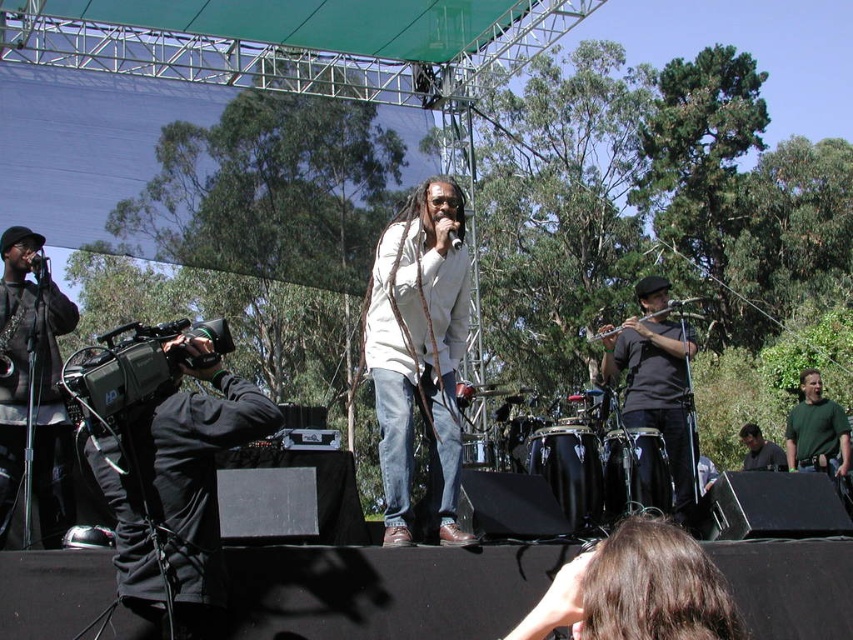
Question: Is green matte shirt at right positioned in front of green matte shirt at center?

Choices:
 (A) no
 (B) yes

Answer: (B)

Question: In this image, where is white matte jacket at center located relative to green matte shirt at center?

Choices:
 (A) left
 (B) right

Answer: (A)

Question: Is black matte shirt at right to the right of green matte shirt at center from the viewer's perspective?

Choices:
 (A) no
 (B) yes

Answer: (A)

Question: Among these points, which one is nearest to the camera?

Choices:
 (A) (451, 444)
 (B) (207, 378)

Answer: (B)

Question: Which object is the farthest from the green matte shirt at center?

Choices:
 (A) white matte jacket at center
 (B) black matte camera at left
 (C) green matte shirt at right

Answer: (B)

Question: Which of the following is the farthest from the observer?

Choices:
 (A) black matte camera at left
 (B) black matte jacket at left

Answer: (B)